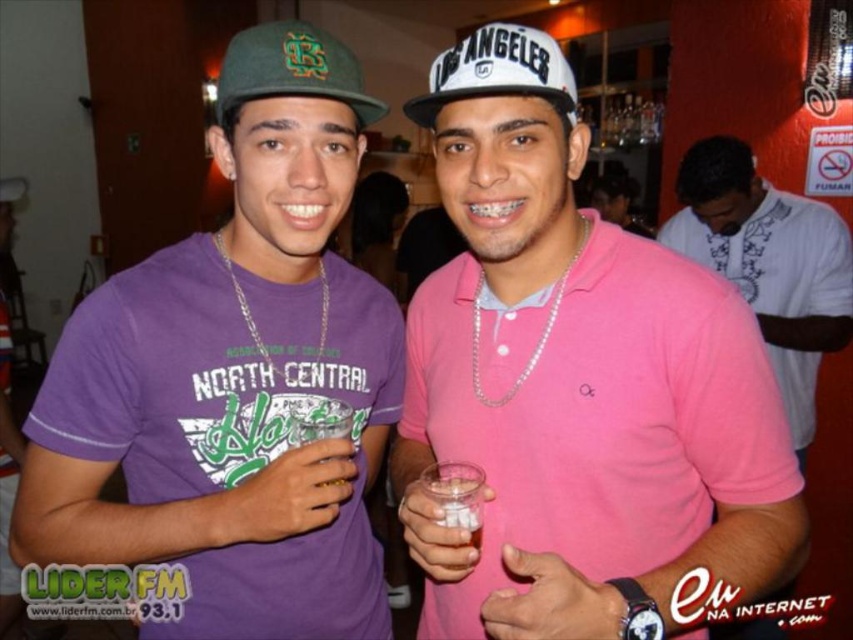
You are at a party and want to introduce yourself to the person wearing the pink matte shirt at center. Which direction should you walk from the green felt baseball cap at upper left to reach them?

The pink matte shirt at center is to the right of the green felt baseball cap at upper left, so you should walk to the right to reach them.

Looking at this image, you are taking a photo of two people at an event. You notice two points in the image labeled as point (x=757, y=269) and point (x=424, y=474). Which point is closer to the camera?

Point (x=757, y=269) is further to the camera than point (x=424, y=474), so the closer point to the camera is point (x=424, y=474).